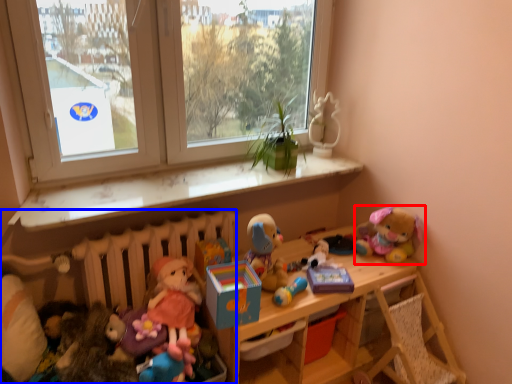
Question: Which point is closer to the camera, toy (highlighted by a red box) or radiator (highlighted by a blue box)?

Choices:
 (A) toy
 (B) radiator

Answer: (B)